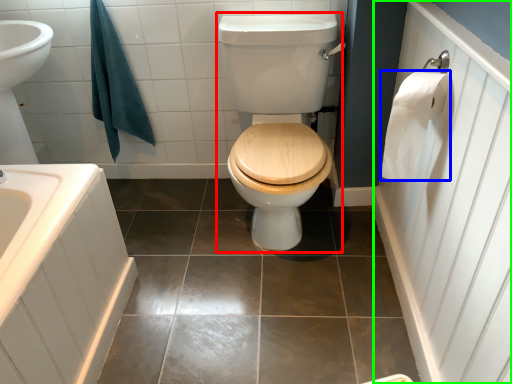
Question: Which object is positioned closest to sit (highlighted by a red box)? Select from toilet paper (highlighted by a blue box) and side (highlighted by a green box).

Choices:
 (A) toilet paper
 (B) side

Answer: (A)